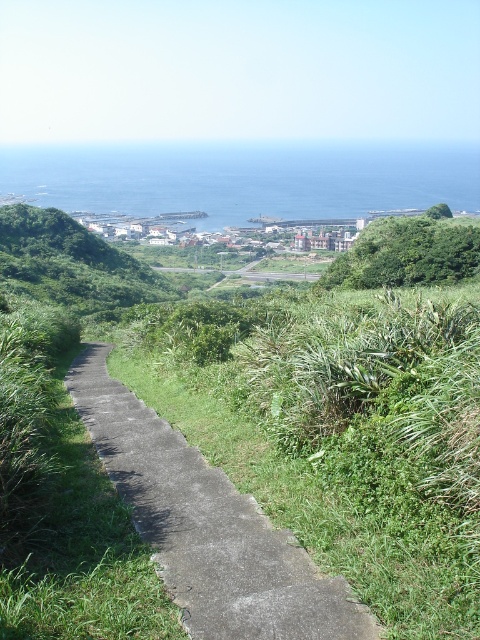
Question: Which of the following is the closest to the observer?

Choices:
 (A) gray concrete path at center
 (B) blue water at upper center

Answer: (A)

Question: Which point is closer to the camera?

Choices:
 (A) (244, 560)
 (B) (149, 273)
 (C) (315, 192)
 (D) (400, 257)

Answer: (A)

Question: Does gray concrete path at center have a larger size compared to green leafy bush at upper right?

Choices:
 (A) no
 (B) yes

Answer: (A)

Question: Estimate the real-world distances between objects in this image. Which object is farther from the green grassy hillside at center?

Choices:
 (A) gray concrete path at center
 (B) green leafy bush at upper right

Answer: (A)

Question: Can you confirm if blue water at upper center is bigger than green grassy hillside at center?

Choices:
 (A) no
 (B) yes

Answer: (B)

Question: Is blue water at upper center thinner than green grassy hillside at center?

Choices:
 (A) yes
 (B) no

Answer: (B)